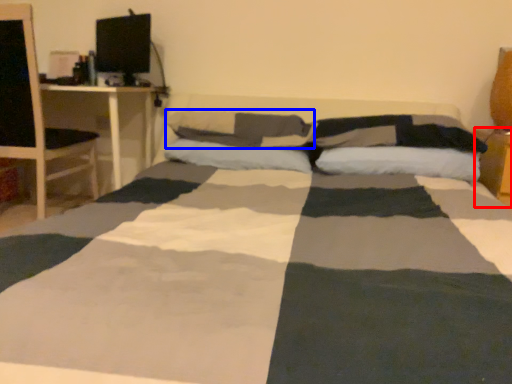
Question: Among these objects, which one is farthest to the camera, table (highlighted by a red box) or pillow (highlighted by a blue box)?

Choices:
 (A) table
 (B) pillow

Answer: (B)